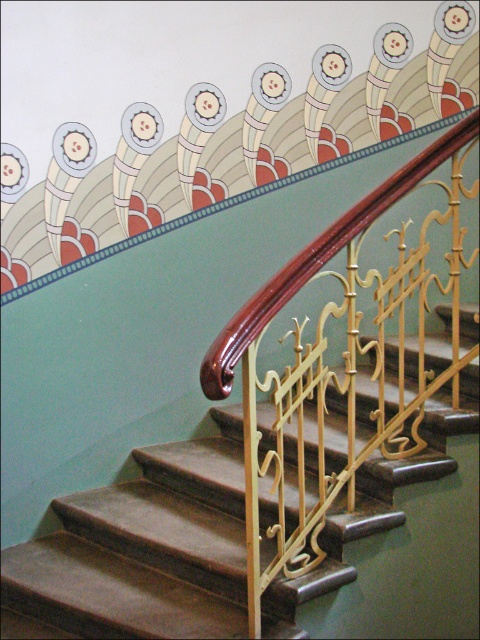
Question: Can you confirm if brown leather stairs at center is wider than glossy wood handrail at upper center?

Choices:
 (A) no
 (B) yes

Answer: (B)

Question: Considering the relative positions of brown leather stairs at center and glossy wood handrail at upper center in the image provided, where is brown leather stairs at center located with respect to glossy wood handrail at upper center?

Choices:
 (A) right
 (B) left

Answer: (B)

Question: Does brown leather stairs at center appear under glossy wood handrail at upper center?

Choices:
 (A) no
 (B) yes

Answer: (B)

Question: Among these objects, which one is nearest to the camera?

Choices:
 (A) glossy wood handrail at upper center
 (B) brown leather stairs at center

Answer: (A)